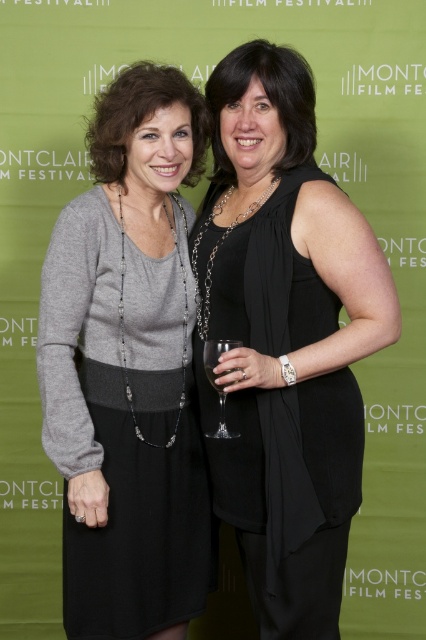
Does matte gray sweater at center have a greater width compared to clear glass wine glass at center?

Indeed, matte gray sweater at center has a greater width compared to clear glass wine glass at center.

Can you confirm if matte gray sweater at center is positioned above clear glass wine glass at center?

Yes.

What do you see at coordinates (127, 369) in the screenshot? The height and width of the screenshot is (640, 426). I see `matte gray sweater at center` at bounding box center [127, 369].

I want to click on matte gray sweater at center, so click(127, 369).

Is black satin dress at center smaller than clear glass wine glass at center?

Incorrect, black satin dress at center is not smaller in size than clear glass wine glass at center.

Looking at this image, which is below, black satin dress at center or clear glass wine glass at center?

clear glass wine glass at center is lower down.

Identify the location of black satin dress at center. click(x=285, y=337).

Where is `black satin dress at center`? This screenshot has width=426, height=640. black satin dress at center is located at coordinates (285, 337).

Is matte gray sweater at center further to the viewer compared to clear glass at center?

Yes, it is.

Is point (54, 241) behind point (212, 371)?

Yes, point (54, 241) is behind point (212, 371).

Locate an element on the screen. The width and height of the screenshot is (426, 640). matte gray sweater at center is located at coordinates (127, 369).